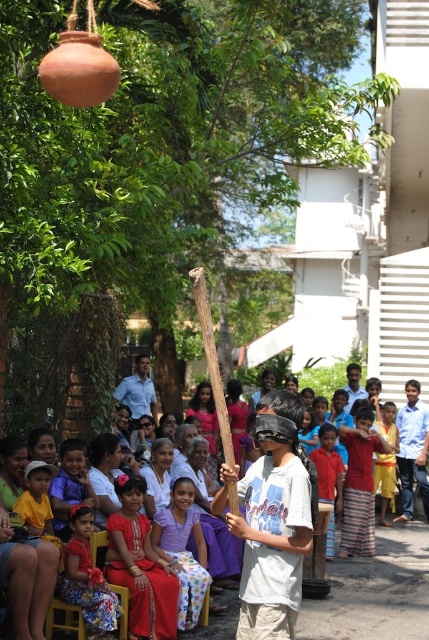
Question: Is blue shirt at center in front of light blue shirt at center?

Choices:
 (A) no
 (B) yes

Answer: (B)

Question: Estimate the real-world distances between objects in this image. Which object is closer to the red cotton dress at center?

Choices:
 (A) light blue shirt at center
 (B) red striped skirt at center
 (C) red cotton shirt at center

Answer: (B)

Question: Among these points, which one is farthest from the camera?

Choices:
 (A) coord(352,371)
 (B) coord(365,451)

Answer: (A)

Question: Does blue shirt at center lie in front of light blue shirt at center?

Choices:
 (A) no
 (B) yes

Answer: (B)

Question: Is red cotton dress at center to the left of light blue shirt at center from the viewer's perspective?

Choices:
 (A) no
 (B) yes

Answer: (A)

Question: Which point is closer to the camera taking this photo?

Choices:
 (A) (395, 435)
 (B) (326, 444)
 (C) (60, 456)

Answer: (C)